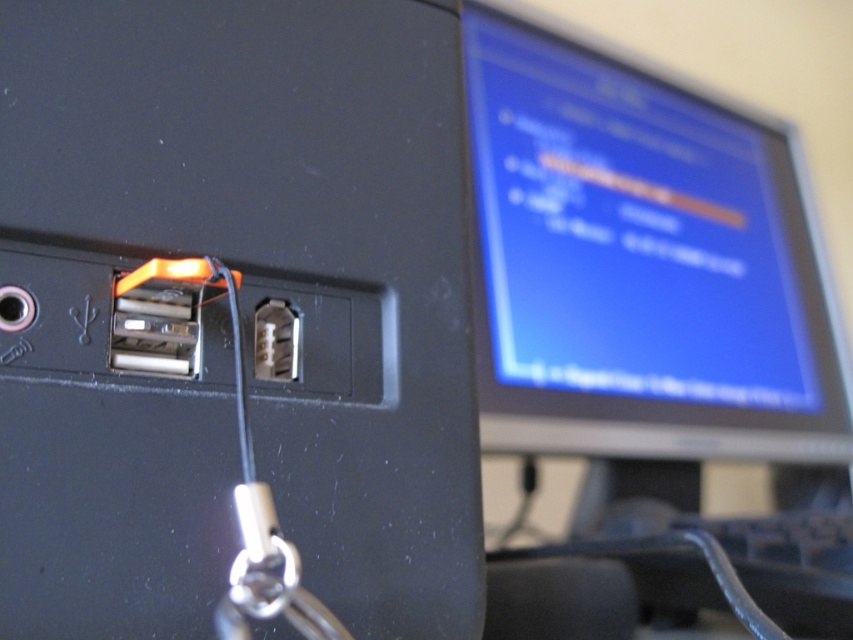
You are a GUI agent. You are given a task and a screenshot of the screen. Output one action in this format:
    pyautogui.click(x=<x>, y=<y>)
    Task: Click on the matte black usb port at center
    This screenshot has height=640, width=853.
    Given the screenshot: What is the action you would take?
    pyautogui.click(x=229, y=310)

Between matte black usb port at center and metallic silver socket at center, which one has more height?

With more height is matte black usb port at center.

Does point (115, 616) come closer to viewer compared to point (294, 372)?

Yes.

I want to click on matte black usb port at center, so click(229, 310).

Is silver metallic keychain at bottom center to the right of metallic silver socket at center from the viewer's perspective?

Yes, silver metallic keychain at bottom center is to the right of metallic silver socket at center.

Does silver metallic keychain at bottom center appear over metallic silver socket at center?

Incorrect, silver metallic keychain at bottom center is not positioned above metallic silver socket at center.

Does point (244, 602) lie in front of point (287, 340)?

Yes, it is in front of point (287, 340).

What are the coordinates of `silver metallic keychain at bottom center` in the screenshot? It's located at (268, 577).

Does black plastic keyboard at lower right lie in front of metallic silver socket at center?

Yes, it is in front of metallic silver socket at center.

Which is in front, point (701, 589) or point (299, 317)?

Point (299, 317)

This screenshot has width=853, height=640. Identify the location of black plastic keyboard at lower right. (735, 568).